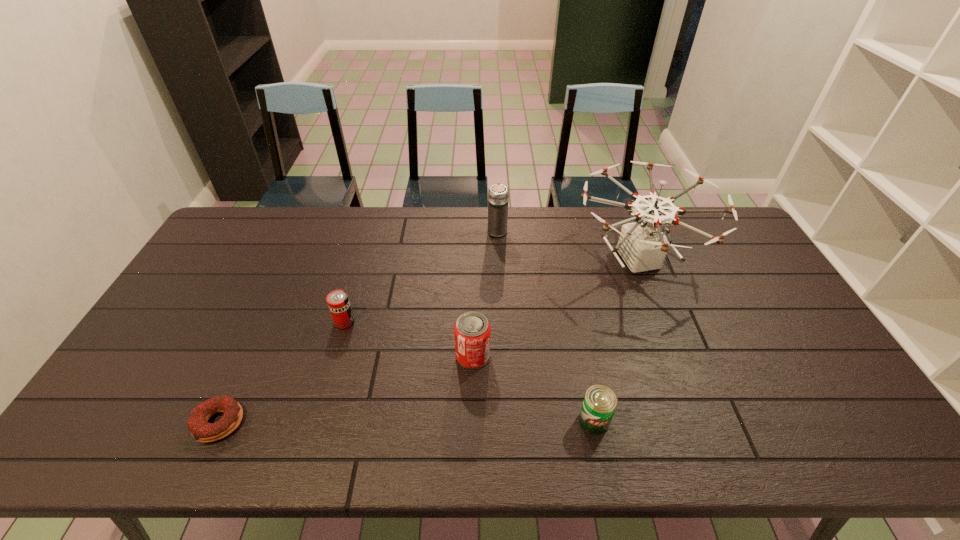
Where is `vacant space located 0.100m with a handle on the side of the thermos bottle`? Image resolution: width=960 pixels, height=540 pixels. vacant space located 0.100m with a handle on the side of the thermos bottle is located at coordinates (496, 207).

Where is `vacant space located 0.070m on the left of the second can from right to left`? Image resolution: width=960 pixels, height=540 pixels. vacant space located 0.070m on the left of the second can from right to left is located at coordinates (430, 356).

You are a GUI agent. You are given a task and a screenshot of the screen. Output one action in this format:
    pyautogui.click(x=<x>, y=<y>)
    Task: Click on the blank space located 0.160m on the back of the farthest can
    This screenshot has height=540, width=960.
    Given the screenshot: What is the action you would take?
    pyautogui.click(x=358, y=277)

What are the coordinates of `free region located 0.350m on the right of the nearest can` in the screenshot? It's located at (755, 420).

Find the location of a particular element. Image resolution: width=960 pixels, height=540 pixels. vacant space located 0.340m on the right of the leftmost object is located at coordinates (385, 423).

This screenshot has width=960, height=540. I want to click on drone located at the far edge, so click(x=642, y=245).

Find the location of a particular element. The width and height of the screenshot is (960, 540). thermos bottle situated at the far edge is located at coordinates (498, 195).

Image resolution: width=960 pixels, height=540 pixels. Identify the location of can that is at the near edge. (600, 402).

What are the coordinates of `doughnut present at the near edge` in the screenshot? It's located at (200, 429).

Locate an element on the screen. vacant space at the far edge of the desktop is located at coordinates (330, 230).